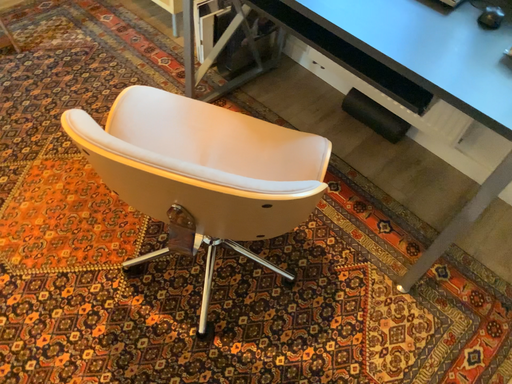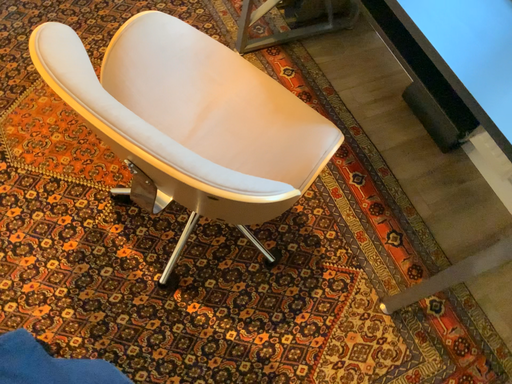
Question: How did the camera likely rotate when shooting the video?

Choices:
 (A) rotated left
 (B) rotated right

Answer: (A)